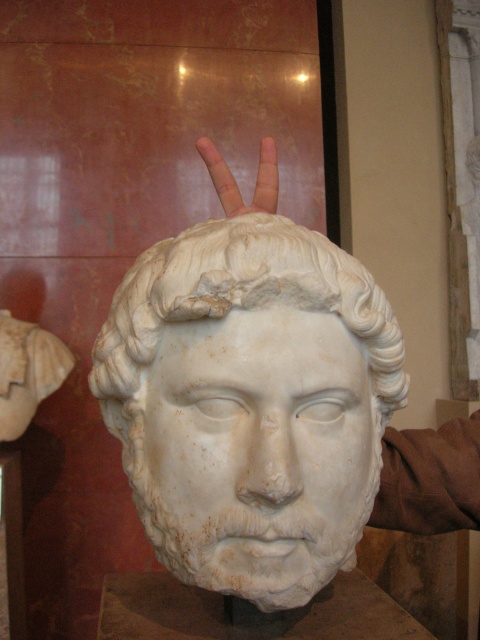
Question: Does white marble head at center appear under skinny flesh at center?

Choices:
 (A) yes
 (B) no

Answer: (A)

Question: Which object appears closest to the camera in this image?

Choices:
 (A) white marble head at center
 (B) skinny flesh at center

Answer: (A)

Question: Which of the following is the closest to the observer?

Choices:
 (A) white marble head at center
 (B) skinny flesh at center

Answer: (A)

Question: Is white marble head at center further to the viewer compared to skinny flesh at center?

Choices:
 (A) no
 (B) yes

Answer: (A)

Question: Is white marble head at center positioned at the back of skinny flesh at center?

Choices:
 (A) no
 (B) yes

Answer: (A)

Question: Which object appears closest to the camera in this image?

Choices:
 (A) white marble head at center
 (B) skinny flesh at center

Answer: (A)